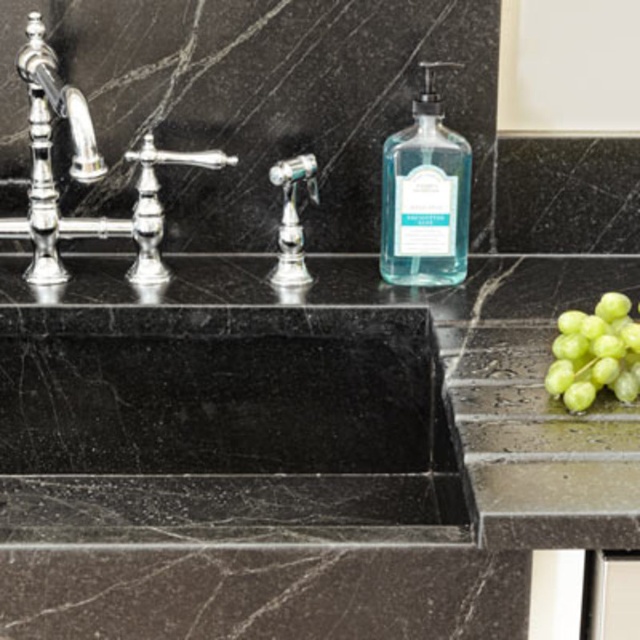
Question: Does black marble sink at center have a larger size compared to polished chrome faucet at center?

Choices:
 (A) yes
 (B) no

Answer: (A)

Question: Does black marble sink at center have a greater width compared to polished chrome faucet at center?

Choices:
 (A) yes
 (B) no

Answer: (A)

Question: Observing the image, what is the correct spatial positioning of polished chrome faucet at left in reference to polished chrome faucet at center?

Choices:
 (A) below
 (B) above

Answer: (B)

Question: Which point is farther to the camera?

Choices:
 (A) (609, 365)
 (B) (440, 67)
 (C) (289, 316)

Answer: (C)

Question: Which point is farther from the camera taking this photo?

Choices:
 (A) (136, 148)
 (B) (173, 592)
 (C) (568, 348)

Answer: (A)

Question: Which object is closer to the camera taking this photo?

Choices:
 (A) polished chrome faucet at center
 (B) polished chrome faucet at left

Answer: (B)